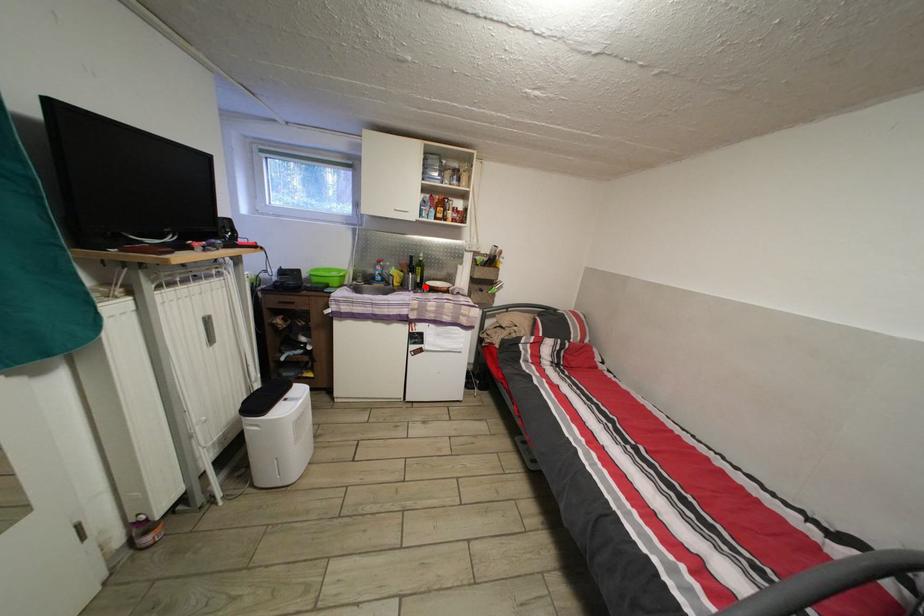
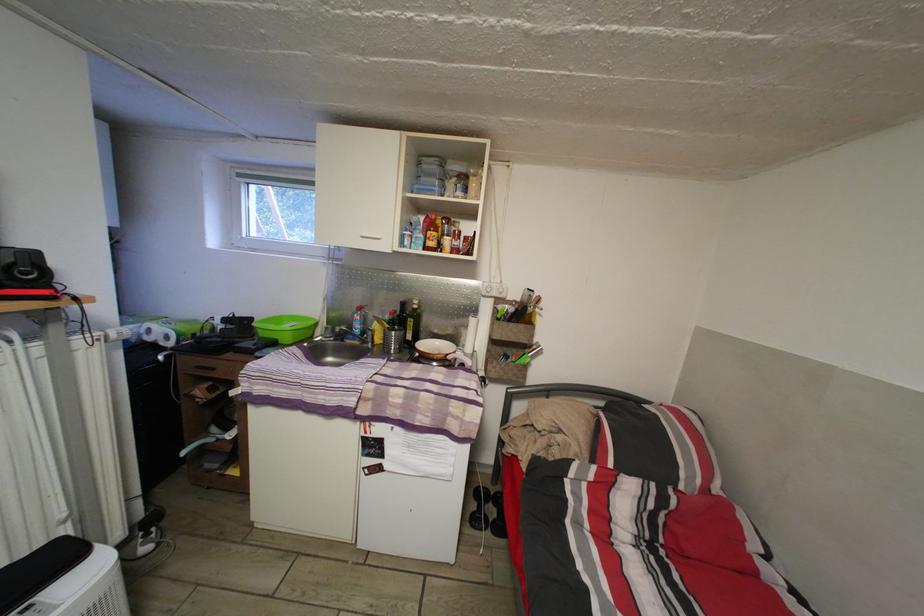
In the second image, find the point that corresponds to the highlighted location in the first image.

(417, 344)